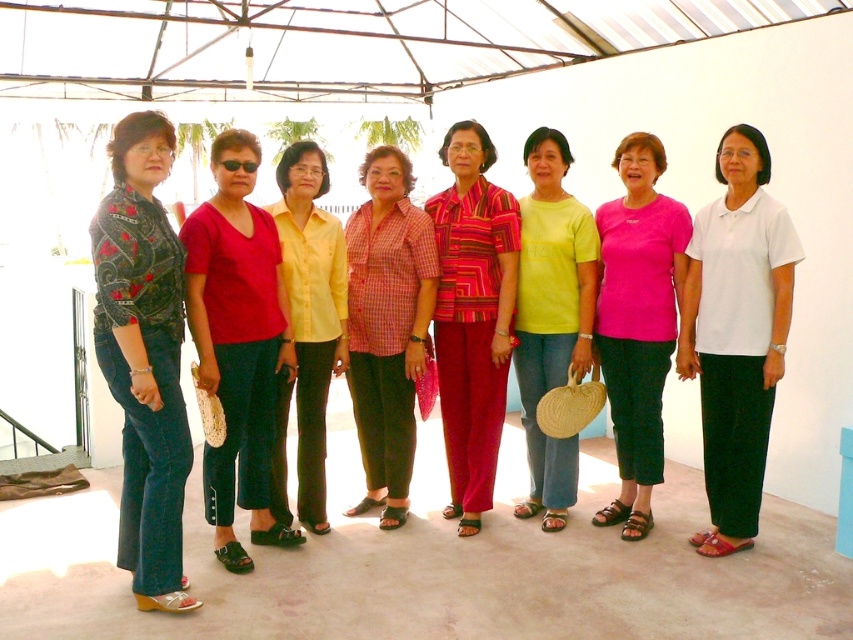
Who is lower down, white cotton blouse at center or pink fabric shirt at center?

Positioned lower is white cotton blouse at center.

Who is more forward, (749,444) or (619,208)?

Positioned in front is point (749,444).

Find the location of `white cotton blouse at center`. white cotton blouse at center is located at coordinates (735, 332).

This screenshot has height=640, width=853. Find the location of `white cotton blouse at center`. white cotton blouse at center is located at coordinates (735, 332).

Does matte red blouse at center appear over yellow cotton shirt at center?

No.

Consider the image. Does matte red blouse at center have a smaller size compared to yellow cotton shirt at center?

No.

Is point (239, 385) positioned before point (561, 224)?

Yes, it is in front of point (561, 224).

The height and width of the screenshot is (640, 853). Find the location of `matte red blouse at center`. matte red blouse at center is located at coordinates (238, 342).

Can you confirm if patterned fabric blouse at left is thinner than white cotton blouse at center?

Incorrect, patterned fabric blouse at left's width is not less than white cotton blouse at center's.

Is patterned fabric blouse at left smaller than white cotton blouse at center?

No, patterned fabric blouse at left is not smaller than white cotton blouse at center.

Who is more distant from viewer, (123, 515) or (775, 248)?

The point (775, 248) is more distant.

The width and height of the screenshot is (853, 640). Identify the location of patterned fabric blouse at left. (144, 356).